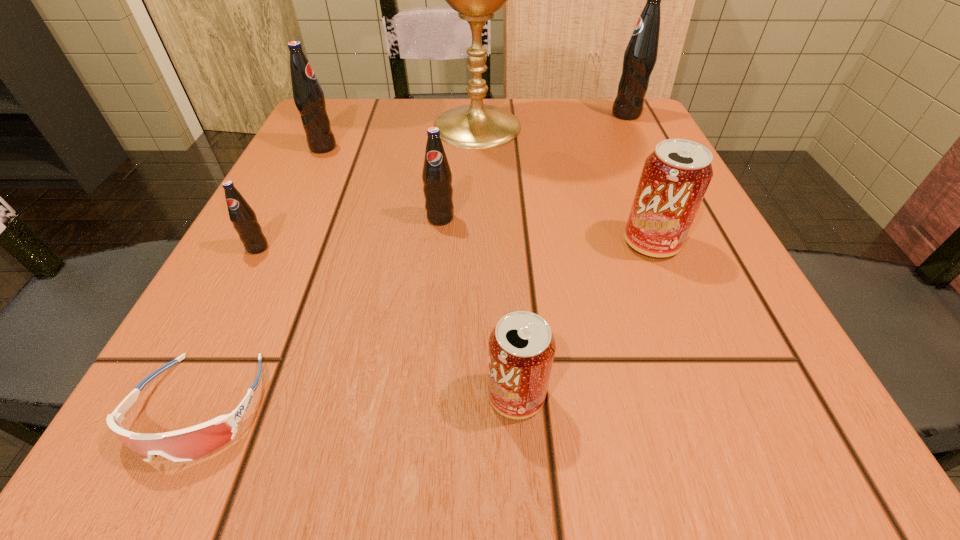
The height and width of the screenshot is (540, 960). Find the location of `vacant space located on the left of the farther red soda can`. vacant space located on the left of the farther red soda can is located at coordinates [461, 242].

Locate an element on the screen. This screenshot has width=960, height=540. blank space located 0.310m on the front label of the nearest black pop is located at coordinates tap(144, 466).

What are the coordinates of `vacant space situated 0.070m on the left of the left red soda can` in the screenshot? It's located at (425, 395).

The image size is (960, 540). I want to click on trophy cup present at the far edge, so click(475, 126).

The width and height of the screenshot is (960, 540). Find the location of `soda can that is at the near edge`. soda can that is at the near edge is located at coordinates (521, 347).

Locate an element on the screen. The image size is (960, 540). goggles that is positioned at the near edge is located at coordinates click(191, 443).

Where is `goggles present at the left edge`? goggles present at the left edge is located at coordinates (191, 443).

Find the location of `object present at the far left corner`. object present at the far left corner is located at coordinates (308, 95).

Locate an element on the screen. This screenshot has width=960, height=540. object that is at the near left corner is located at coordinates (191, 443).

Where is `object that is positioned at the far right corner`? object that is positioned at the far right corner is located at coordinates (640, 55).